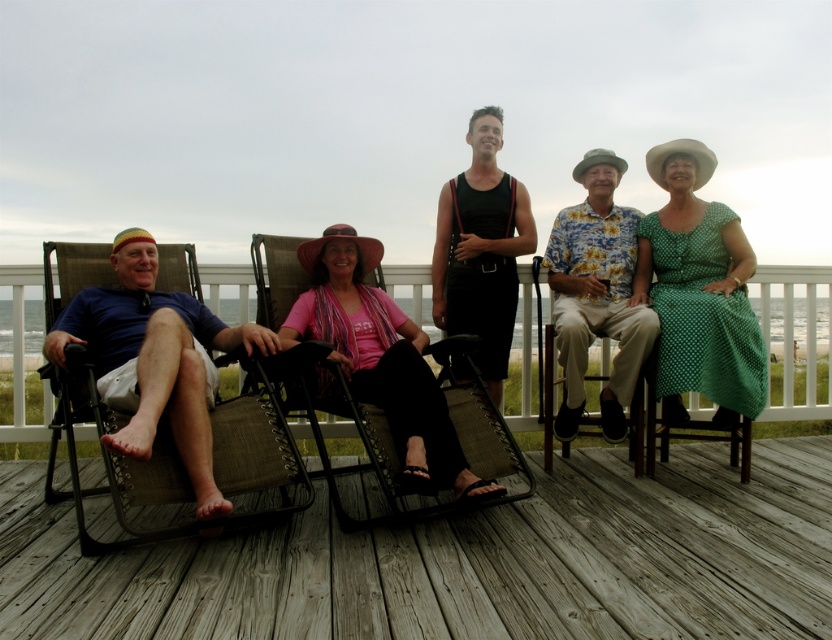
Based on the photo, is pink fabric dress at center smaller than black fabric dress at center?

Incorrect, pink fabric dress at center is not smaller in size than black fabric dress at center.

Between pink fabric dress at center and black fabric dress at center, which one appears on the left side from the viewer's perspective?

Positioned to the left is pink fabric dress at center.

Does point (407, 400) lie behind point (434, 304)?

No, (407, 400) is closer to viewer.

The width and height of the screenshot is (832, 640). What are the coordinates of `pink fabric dress at center` in the screenshot? It's located at (380, 358).

Between brown woven deck at center and brown woven beach chair at left, which one has less height?

brown woven deck at center

Does point (818, 620) come in front of point (110, 442)?

Yes, it is in front of point (110, 442).

Locate an element on the screen. The width and height of the screenshot is (832, 640). brown woven deck at center is located at coordinates (462, 561).

Does brown woven beach chair at left have a greater width compared to black fabric dress at center?

Yes, brown woven beach chair at left is wider than black fabric dress at center.

Which of these two, brown woven beach chair at left or black fabric dress at center, stands shorter?

brown woven beach chair at left

Is point (206, 342) positioned before point (479, 323)?

Yes, it is.

Find the location of `brown woven beach chair at left`. brown woven beach chair at left is located at coordinates (169, 400).